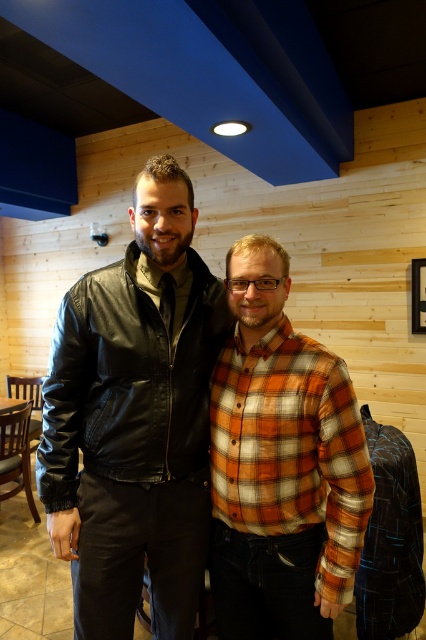
Question: Can you confirm if black leather jacket at center is positioned below orange plaid shirt at center?

Choices:
 (A) yes
 (B) no

Answer: (B)

Question: Among these points, which one is farthest from the camera?

Choices:
 (A) pos(337,500)
 (B) pos(154,186)

Answer: (B)

Question: Does black leather jacket at center appear on the left side of orange plaid shirt at center?

Choices:
 (A) yes
 (B) no

Answer: (A)

Question: Which point is farther from the camera taking this photo?

Choices:
 (A) (249, 545)
 (B) (192, 524)

Answer: (B)

Question: Which object appears closest to the camera in this image?

Choices:
 (A) orange plaid shirt at center
 (B) black leather jacket at center

Answer: (A)

Question: Can you confirm if black leather jacket at center is positioned above orange plaid shirt at center?

Choices:
 (A) no
 (B) yes

Answer: (B)